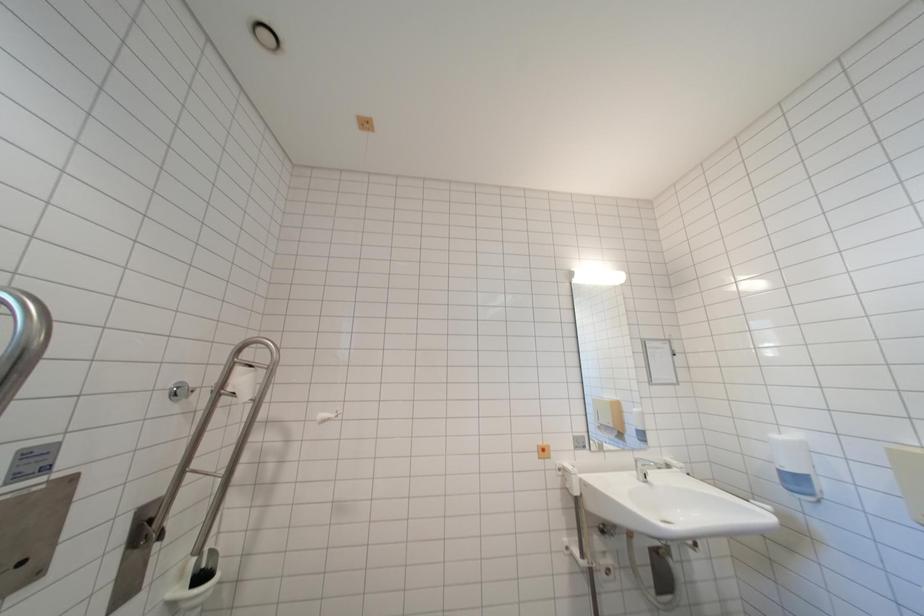
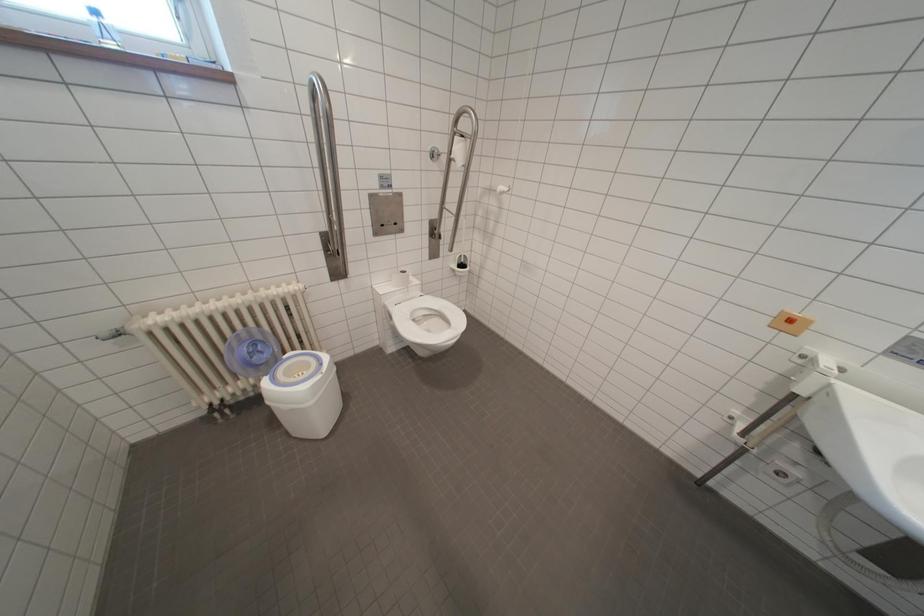
The images are taken continuously from a first-person perspective. In which direction is your viewpoint rotating?

The rotation direction of the camera is left-down.